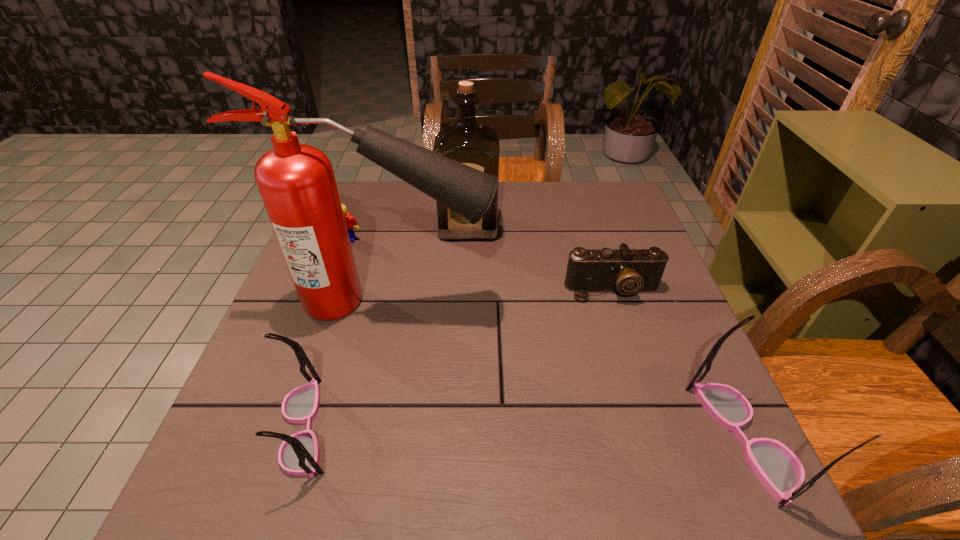
You are a GUI agent. You are given a task and a screenshot of the screen. Output one action in this format:
    pyautogui.click(x=<x>, y=<y>)
    Task: Click on the free space located 0.090m on the front-facing side of the camera
    The width and height of the screenshot is (960, 540).
    Given the screenshot: What is the action you would take?
    pyautogui.click(x=627, y=334)

In order to click on vacant region located on the label of the liquor in this screenshot , I will do `click(466, 323)`.

At what (x,y) coordinates should I click in order to perform the action: click on vacant area located 0.060m on the front-facing side of the Lego. Please return your answer as a coordinate pair (x, y). This screenshot has width=960, height=540. Looking at the image, I should click on (342, 257).

The width and height of the screenshot is (960, 540). What are the coordinates of `vacant space located at the nozzle of the fire extinguisher` in the screenshot? It's located at (564, 301).

Identify the location of object positioned at the far edge. (476, 145).

I want to click on spectacles located at the left edge, so click(298, 455).

Locate an element on the screen. The height and width of the screenshot is (540, 960). Lego that is at the left edge is located at coordinates (350, 220).

Locate an element on the screen. This screenshot has height=540, width=960. fire extinguisher located in the left edge section of the desktop is located at coordinates (297, 184).

Locate an element on the screen. The width and height of the screenshot is (960, 540). spectacles at the right edge is located at coordinates (779, 470).

This screenshot has height=540, width=960. Find the location of `camera located in the right edge section of the desktop`. camera located in the right edge section of the desktop is located at coordinates (625, 270).